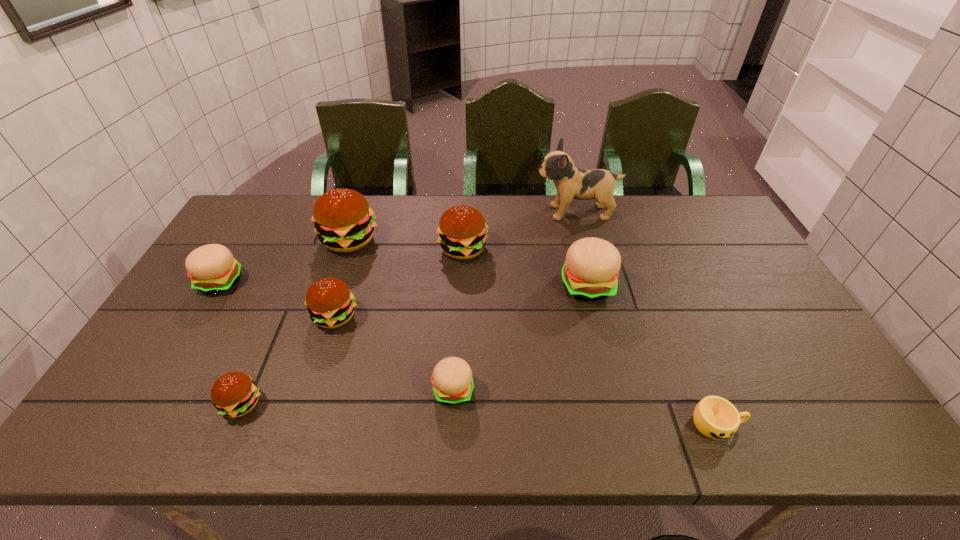
In order to click on empty location between the tallest object and the leftmost beige hamburger in this screenshot , I will do `click(398, 247)`.

Identify which object is the eighth nearest to the rightmost beige hamburger. Please provide its 2D coordinates. Your answer should be formatted as a tuple, i.e. [(x, y)], where the tuple contains the x and y coordinates of a point satisfying the conditions above.

[(212, 269)]

The width and height of the screenshot is (960, 540). I want to click on the eighth closest object to the rightmost hamburger, so click(212, 269).

Locate which hamburger ranks fourth in proximity to the second tallest object. Please provide its 2D coordinates. Your answer should be formatted as a tuple, i.e. [(x, y)], where the tuple contains the x and y coordinates of a point satisfying the conditions above.

[(234, 394)]

Locate which hamburger is the closest to the second tallest object. Please provide its 2D coordinates. Your answer should be formatted as a tuple, i.e. [(x, y)], where the tuple contains the x and y coordinates of a point satisfying the conditions above.

[(330, 304)]

Where is `brown hamburger that stands as the third closest to the tallest hamburger`? This screenshot has height=540, width=960. brown hamburger that stands as the third closest to the tallest hamburger is located at coordinates (234, 394).

Identify which brown hamburger is the fourth nearest to the nearest beige hamburger. Please provide its 2D coordinates. Your answer should be formatted as a tuple, i.e. [(x, y)], where the tuple contains the x and y coordinates of a point satisfying the conditions above.

[(343, 220)]

The image size is (960, 540). What are the coordinates of `beige hamburger that can be found as the closest to the second nearest brown hamburger` in the screenshot? It's located at (212, 269).

This screenshot has height=540, width=960. Find the location of `the closest beige hamburger to the third biggest brown hamburger`. the closest beige hamburger to the third biggest brown hamburger is located at coordinates (212, 269).

Locate an element on the screen. This screenshot has width=960, height=540. free location that satisfies the following two spatial constraints: 1. at the face of the beige cup; 2. on the right side of the puppy is located at coordinates (632, 424).